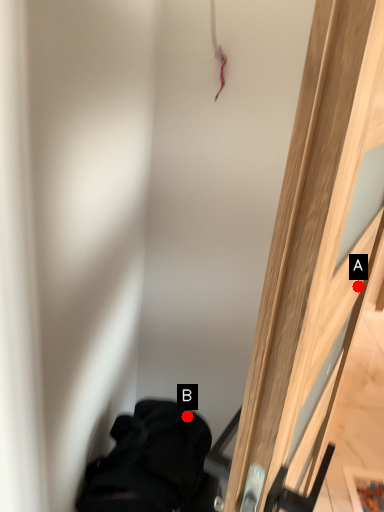
Question: Two points are circled on the image, labeled by A and B beside each circle. Among these points, which one is nearest to the camera?

Choices:
 (A) A is closer
 (B) B is closer

Answer: (B)